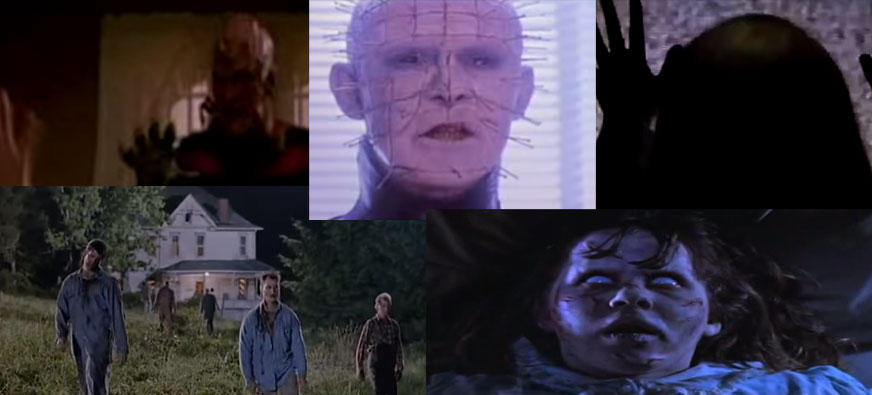
Locate an element on the screen. The image size is (872, 395). window is located at coordinates (198, 239), (241, 245).